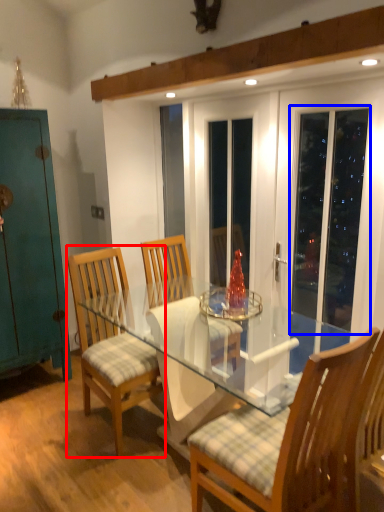
Question: Among these objects, which one is farthest to the camera, chair (highlighted by a red box) or screen door (highlighted by a blue box)?

Choices:
 (A) chair
 (B) screen door

Answer: (A)